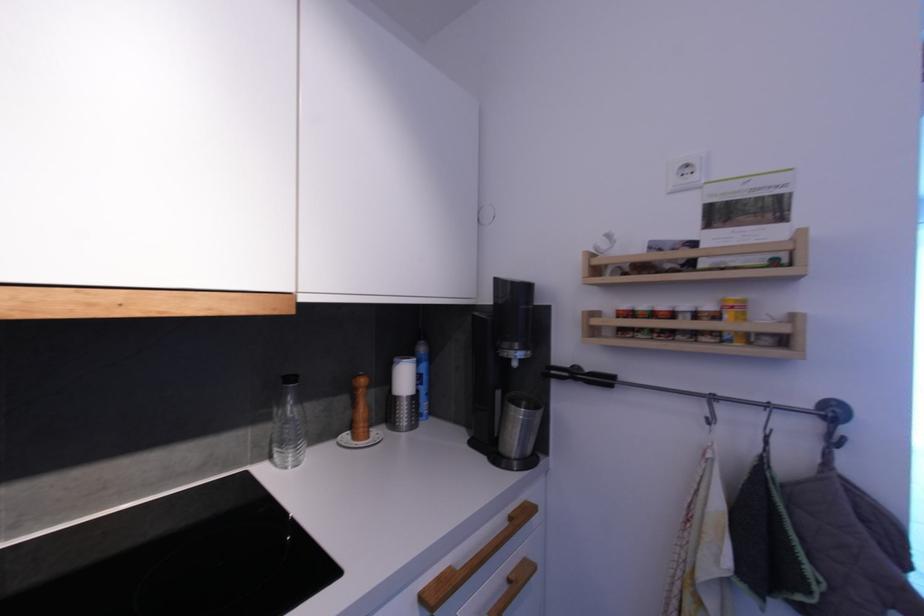
The image size is (924, 616). What are the coordinates of `spray can nozzle` in the screenshot? It's located at (157, 589).